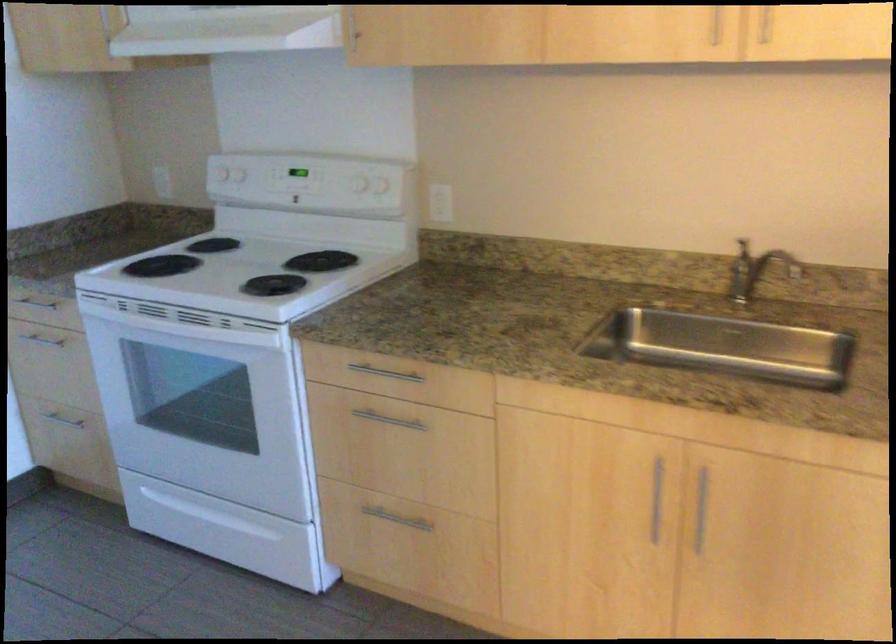
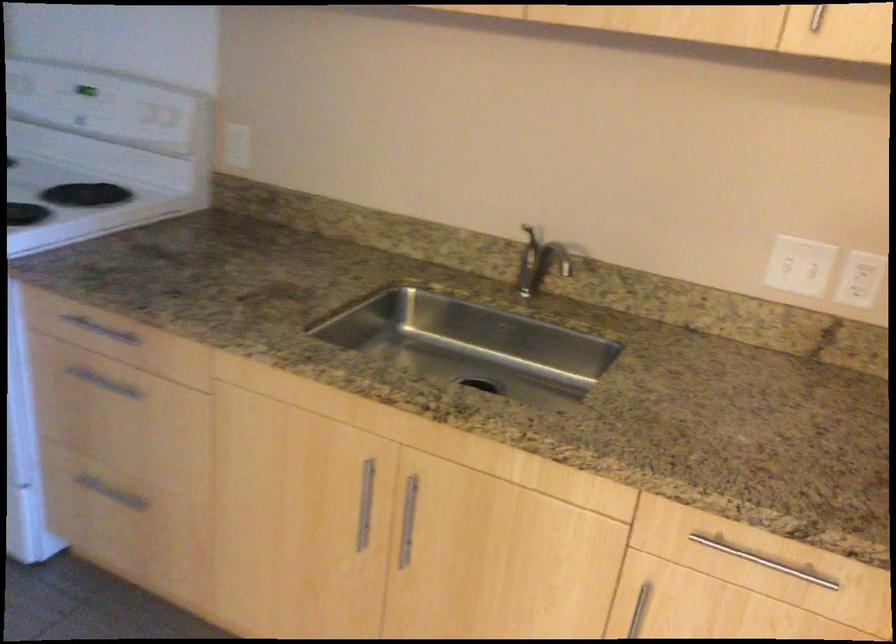
Locate, in the second image, the point that corresponds to [295,167] in the first image.

(85, 90)